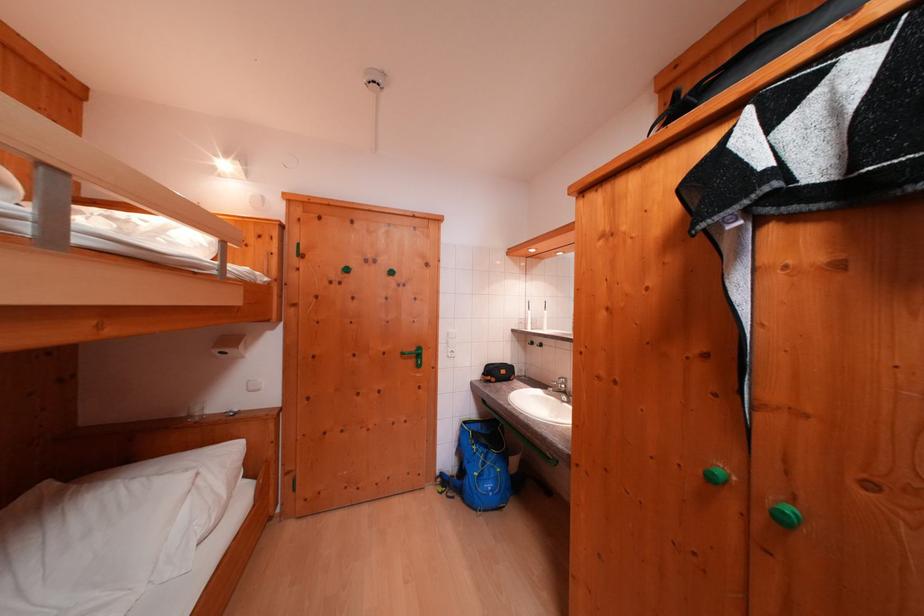
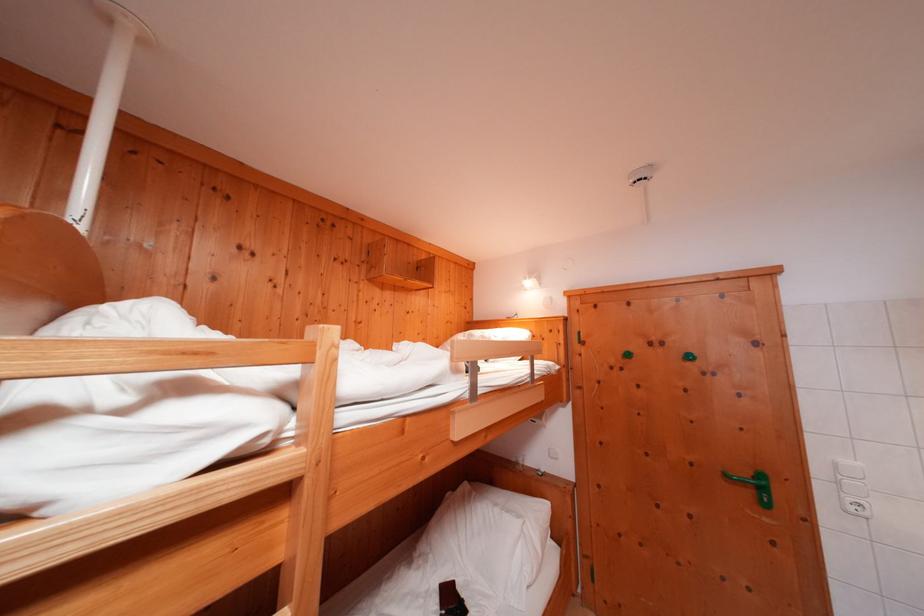
Where in the second image is the point corresponding to (427,360) from the first image?

(771, 493)